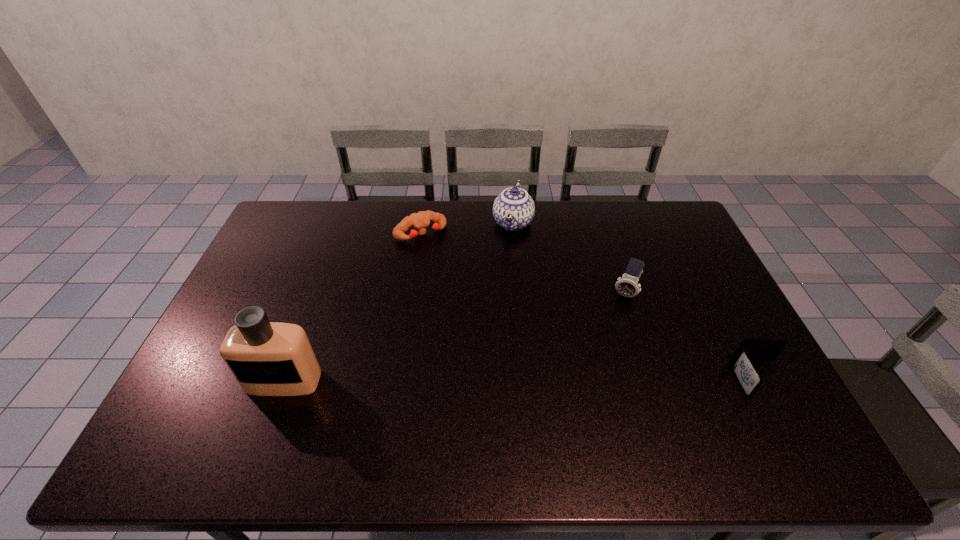
You are a GUI agent. You are given a task and a screenshot of the screen. Output one action in this format:
    pyautogui.click(x=<x>, y=<y>)
    Task: Click on the perfume
    
    Given the screenshot: What is the action you would take?
    pyautogui.click(x=267, y=358)

This screenshot has width=960, height=540. What are the coordinates of `the tallest object` in the screenshot? It's located at (267, 358).

Where is `wallet`? This screenshot has height=540, width=960. wallet is located at coordinates (749, 350).

Find the location of a particular element. chinaware is located at coordinates (513, 209).

Locate an element on the screen. the fourth shortest object is located at coordinates (513, 209).

The image size is (960, 540). In order to click on watch in this screenshot , I will do `click(628, 286)`.

Locate an element on the screen. the third farthest object is located at coordinates (628, 286).

At what (x,y) coordinates should I click in order to perform the action: click on puncher. Please return your answer as a coordinate pair (x, y). Looking at the image, I should click on (419, 221).

At what (x,y) coordinates should I click in order to perform the action: click on vacant position located 0.380m from the spout of the chinaware. Please return your answer as a coordinate pair (x, y). The height and width of the screenshot is (540, 960). Looking at the image, I should click on (481, 323).

Where is `vacant space positioned from the spout of the chinaware`? Image resolution: width=960 pixels, height=540 pixels. vacant space positioned from the spout of the chinaware is located at coordinates (502, 262).